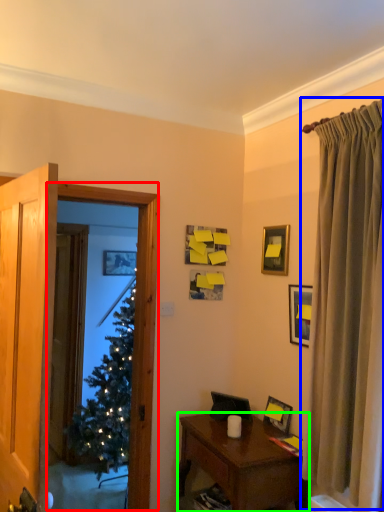
Question: Considering the real-world distances, which object is farthest from window screen (highlighted by a red box)? curtain (highlighted by a blue box) or nightstand (highlighted by a green box)?

Choices:
 (A) curtain
 (B) nightstand

Answer: (A)